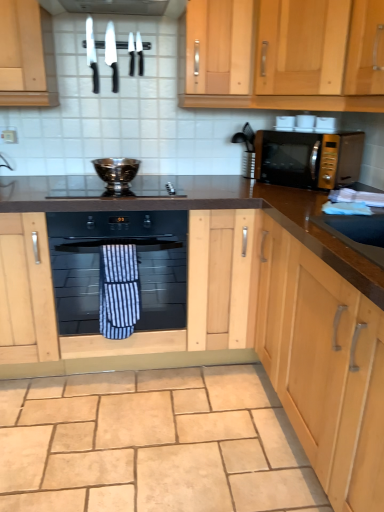
Question: Is shiny silver knife at upper left, which appears as the first knife when viewed from the left, behind blue striped towel at center?

Choices:
 (A) no
 (B) yes

Answer: (B)

Question: From the image's perspective, is shiny silver knife at upper left, the fourth knife viewed from the right, located above blue striped towel at center?

Choices:
 (A) no
 (B) yes

Answer: (B)

Question: Are shiny silver knife at upper left, which appears as the first knife when viewed from the left, and blue striped towel at center located far from each other?

Choices:
 (A) no
 (B) yes

Answer: (B)

Question: Does shiny silver knife at upper left, which appears as the first knife when viewed from the left, have a lesser width compared to blue striped towel at center?

Choices:
 (A) yes
 (B) no

Answer: (A)

Question: Is shiny silver knife at upper left, which appears as the first knife when viewed from the left, outside of blue striped towel at center?

Choices:
 (A) no
 (B) yes

Answer: (B)

Question: Does shiny silver knife at upper left, the fourth knife viewed from the right, have a smaller size compared to blue striped towel at center?

Choices:
 (A) yes
 (B) no

Answer: (A)

Question: Is shiny silver knife at upper center, positioned as the second knife in left-to-right order, smaller than gold metallic microwave at upper right?

Choices:
 (A) no
 (B) yes

Answer: (B)

Question: Is shiny silver knife at upper center, positioned as the second knife in left-to-right order, aimed at gold metallic microwave at upper right?

Choices:
 (A) no
 (B) yes

Answer: (A)

Question: From the image's perspective, does shiny silver knife at upper center, positioned as the 3th knife in right-to-left order, appear higher than gold metallic microwave at upper right?

Choices:
 (A) no
 (B) yes

Answer: (B)

Question: Can gold metallic microwave at upper right be found inside shiny silver knife at upper center, positioned as the second knife in left-to-right order?

Choices:
 (A) yes
 (B) no

Answer: (B)

Question: Is shiny silver knife at upper center, positioned as the second knife in left-to-right order, placed right next to gold metallic microwave at upper right?

Choices:
 (A) yes
 (B) no

Answer: (B)

Question: From a real-world perspective, is shiny silver knife at upper center, positioned as the 3th knife in right-to-left order, located higher than gold metallic microwave at upper right?

Choices:
 (A) no
 (B) yes

Answer: (B)

Question: Is black glass gas stove at center at the right side of beige stone floor at lower center?

Choices:
 (A) yes
 (B) no

Answer: (B)